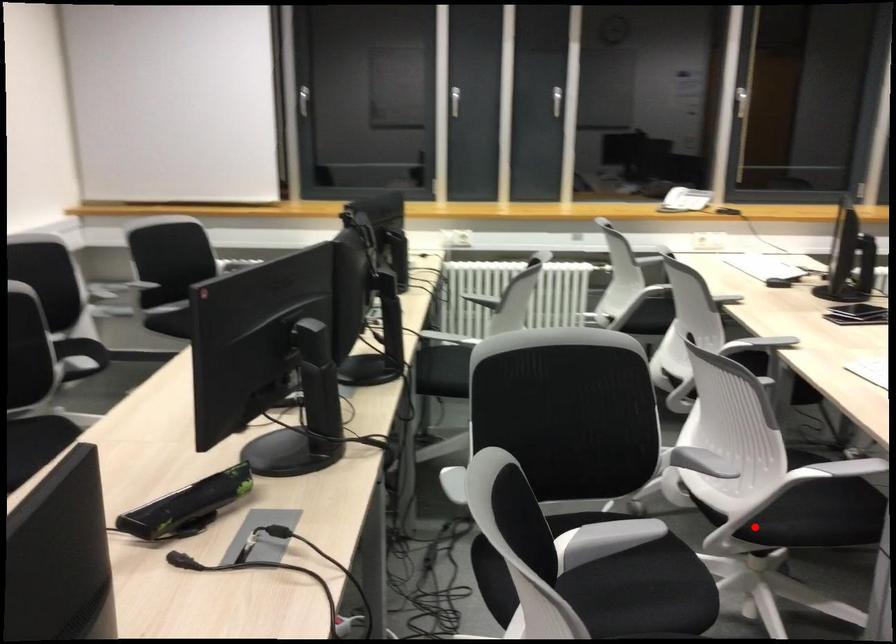
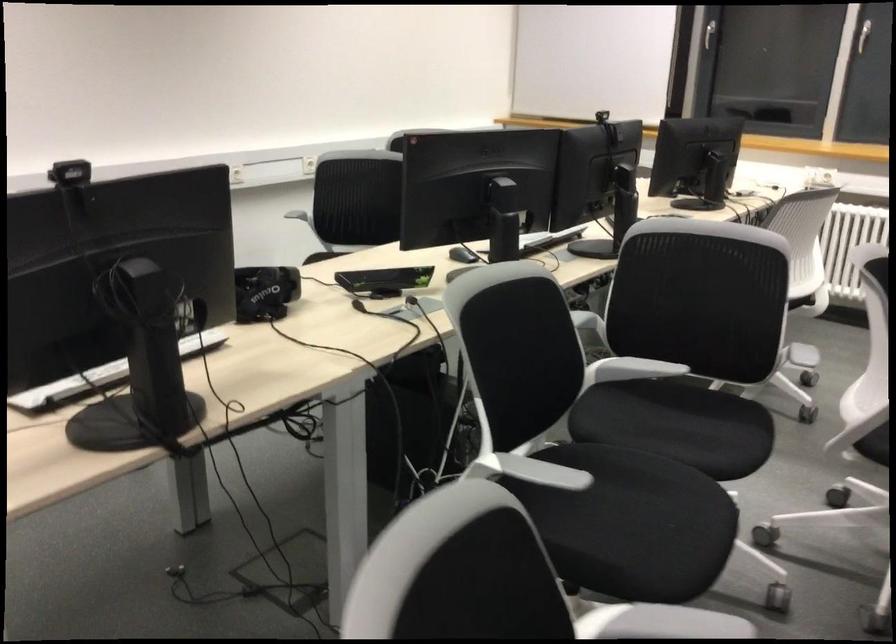
Where in the second image is the point corresponding to the highlighted location from the first image?

(874, 444)